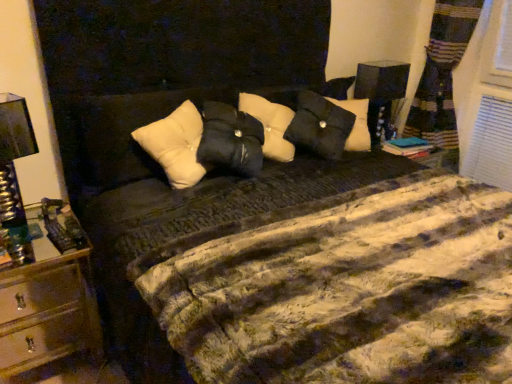
Question: From a real-world perspective, is white soft pillow at center located higher than metallic gold nightstand at left?

Choices:
 (A) no
 (B) yes

Answer: (B)

Question: Is white soft pillow at center positioned with its back to metallic gold nightstand at left?

Choices:
 (A) yes
 (B) no

Answer: (B)

Question: Is white soft pillow at center thinner than metallic gold nightstand at left?

Choices:
 (A) no
 (B) yes

Answer: (B)

Question: Considering the relative positions of white soft pillow at center and metallic gold nightstand at left in the image provided, is white soft pillow at center to the right of metallic gold nightstand at left from the viewer's perspective?

Choices:
 (A) yes
 (B) no

Answer: (A)

Question: Is white soft pillow at center taller than metallic gold nightstand at left?

Choices:
 (A) yes
 (B) no

Answer: (B)

Question: From the image's perspective, is metallic silver lamp at left, marked as the first bedside lamp in a bottom-to-top arrangement, above or below metallic gold nightstand at left?

Choices:
 (A) below
 (B) above

Answer: (B)

Question: Looking at their shapes, would you say metallic silver lamp at left, which ranks as the 2th bedside lamp in back-to-front order, is wider or thinner than metallic gold nightstand at left?

Choices:
 (A) thin
 (B) wide

Answer: (A)

Question: Relative to metallic gold nightstand at left, is metallic silver lamp at left, which ranks as the 2th bedside lamp in back-to-front order, in front or behind?

Choices:
 (A) front
 (B) behind

Answer: (B)

Question: In terms of size, does metallic silver lamp at left, placed as the 1th bedside lamp when sorted from front to back, appear bigger or smaller than metallic gold nightstand at left?

Choices:
 (A) small
 (B) big

Answer: (A)

Question: Is white soft pillow at center inside or outside of metallic silver lamp at left, which is the first bedside lamp in left-to-right order?

Choices:
 (A) inside
 (B) outside

Answer: (B)

Question: Is white soft pillow at center taller or shorter than metallic silver lamp at left, which is the second bedside lamp in top-to-bottom order?

Choices:
 (A) tall
 (B) short

Answer: (B)

Question: Would you say white soft pillow at center is to the left or to the right of metallic silver lamp at left, marked as the second bedside lamp in a right-to-left arrangement, in the picture?

Choices:
 (A) right
 (B) left

Answer: (A)

Question: Looking at their shapes, would you say white soft pillow at center is wider or thinner than metallic silver lamp at left, which ranks as the 2th bedside lamp in back-to-front order?

Choices:
 (A) wide
 (B) thin

Answer: (A)

Question: Is metallic gold nightstand at left inside or outside of black fabric lampshade at upper right, the first bedside lamp from the top?

Choices:
 (A) outside
 (B) inside

Answer: (A)

Question: Is metallic gold nightstand at left bigger or smaller than black fabric lampshade at upper right, the second bedside lamp when ordered from front to back?

Choices:
 (A) small
 (B) big

Answer: (B)